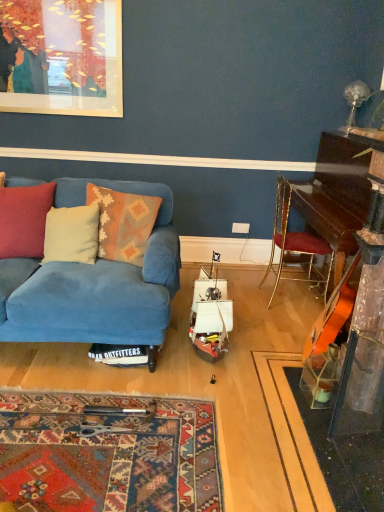
Where is `free space behind gold metallic chair at right`? free space behind gold metallic chair at right is located at coordinates (262, 271).